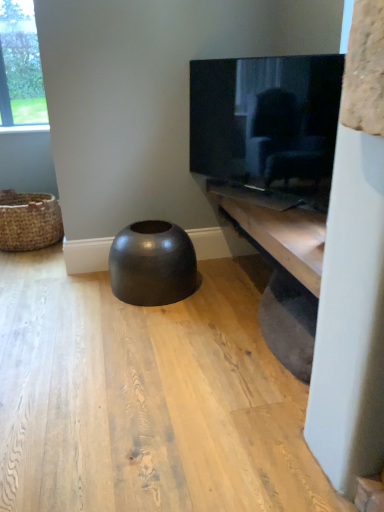
This screenshot has width=384, height=512. I want to click on vacant space to the left of glossy black stool at center, so click(x=67, y=294).